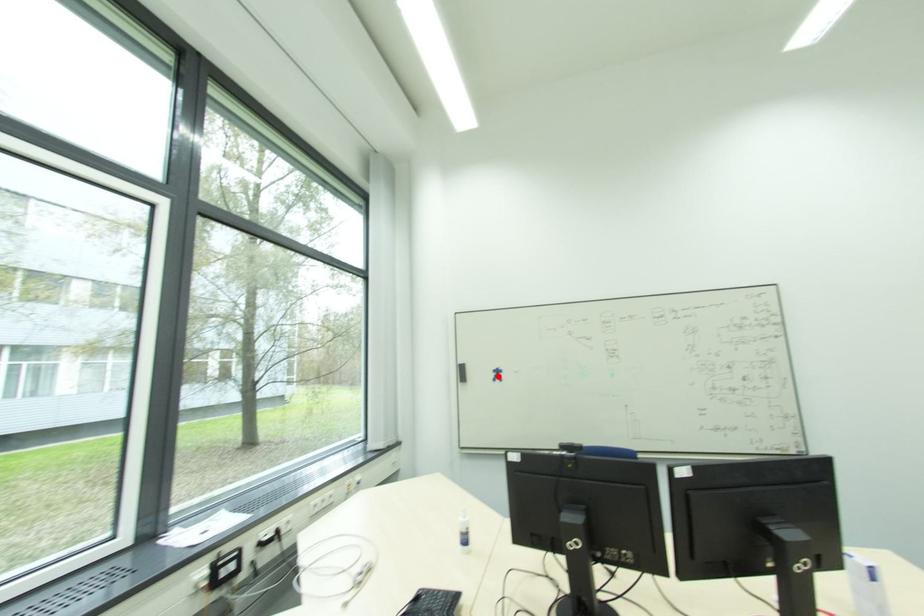
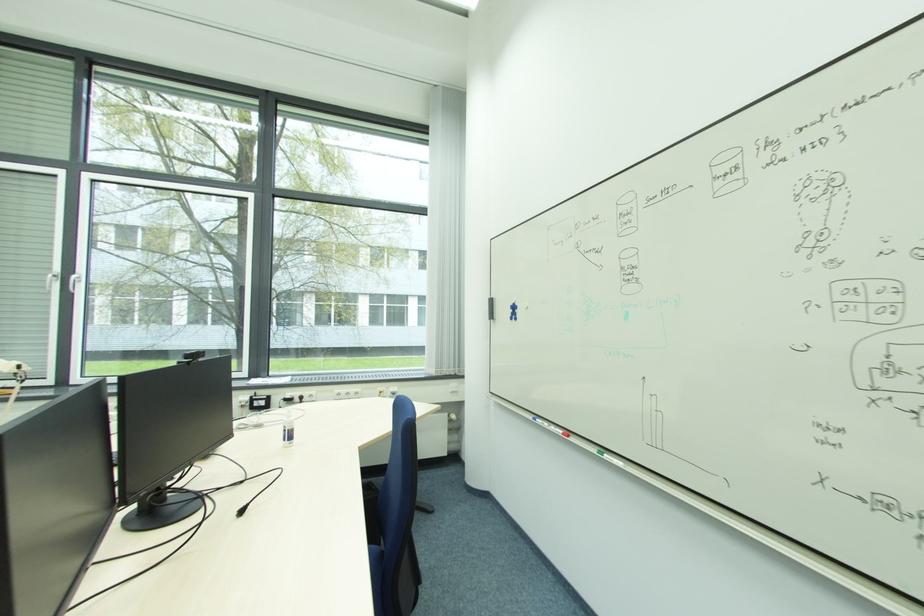
The point at the highlighted location is marked in the first image. Where is the corresponding point in the second image?

(515, 313)